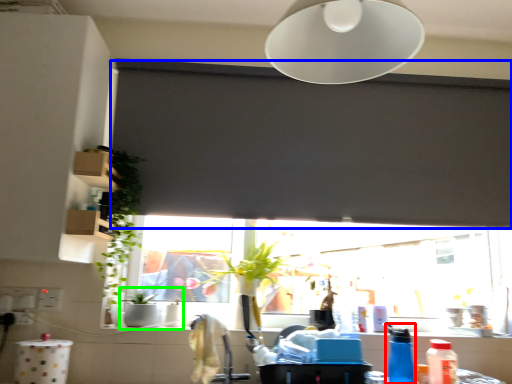
Question: Which object is positioned closest to bottle (highlighted by a red box)? Select from window screen (highlighted by a blue box) and sink (highlighted by a green box).

Choices:
 (A) window screen
 (B) sink

Answer: (A)